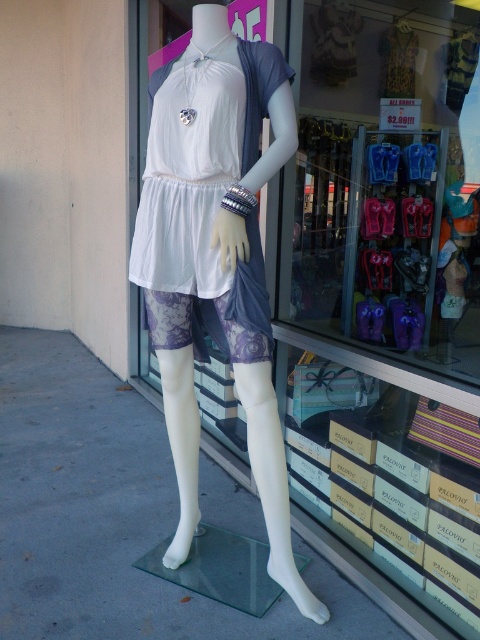
Does purple fabric at center appear under white matte dress at center?

Incorrect, purple fabric at center is not positioned below white matte dress at center.

The width and height of the screenshot is (480, 640). Describe the element at coordinates (383, 298) in the screenshot. I see `purple fabric at center` at that location.

This screenshot has width=480, height=640. Describe the element at coordinates (383, 298) in the screenshot. I see `purple fabric at center` at that location.

I want to click on purple fabric at center, so click(383, 298).

Does lace fabric shorts at center have a larger size compared to white matte dress at center?

Correct, lace fabric shorts at center is larger in size than white matte dress at center.

The height and width of the screenshot is (640, 480). In order to click on lace fabric shorts at center in this screenshot , I will do `click(215, 257)`.

Which is in front, point (271, 483) or point (180, 234)?

Positioned in front is point (271, 483).

Identify the location of lace fabric shorts at center. The image size is (480, 640). (215, 257).

Can you confirm if purple fabric at center is thinner than lace fabric shorts at center?

No, purple fabric at center is not thinner than lace fabric shorts at center.

Between point (381, 429) and point (165, 412), which one is positioned in front?

Point (381, 429) is in front.

Is point (343, 109) farther from viewer compared to point (266, 412)?

Yes, point (343, 109) is farther from viewer.

The height and width of the screenshot is (640, 480). I want to click on purple fabric at center, so click(x=383, y=298).